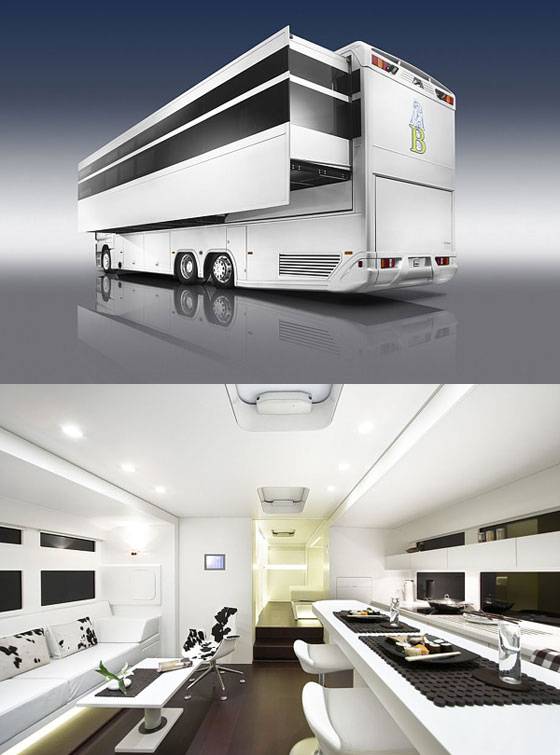
Identify the location of table. The image size is (560, 755). (160, 686).